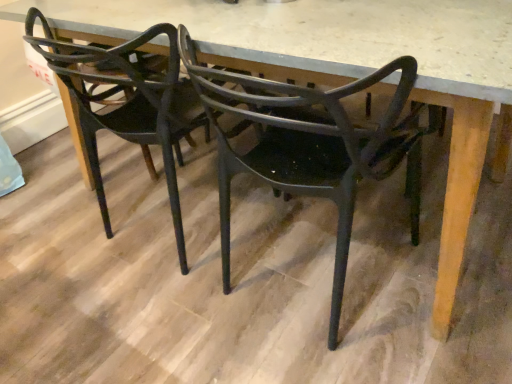
Identify the location of vacant region in front of matte black chair at center, which appears as the second chair when viewed from the right. The height and width of the screenshot is (384, 512). (139, 333).